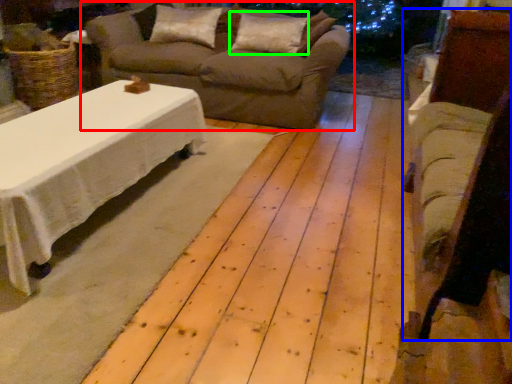
Question: Which is nearer to the studio couch (highlighted by a red box)? armchair (highlighted by a blue box) or pillow (highlighted by a green box).

Choices:
 (A) armchair
 (B) pillow

Answer: (B)